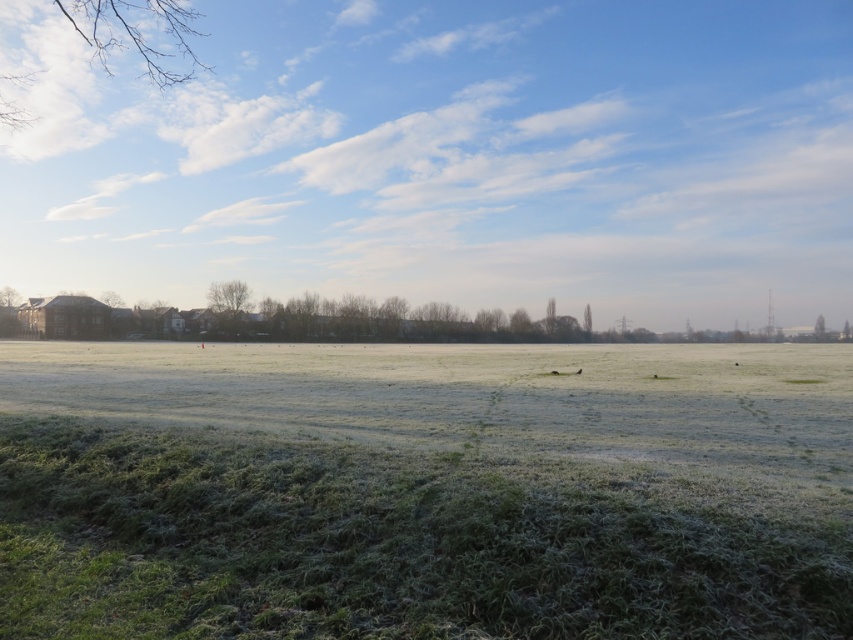
Question: Which point is closer to the camera?

Choices:
 (A) frosted grass at lower center
 (B) green matte tree at left
 (C) bare branches at upper left
 (D) green matte tree at right

Answer: (A)

Question: Which of the following is the closest to the observer?

Choices:
 (A) bare branches at upper left
 (B) green matte tree at left
 (C) green matte tree at right
 (D) frosted grass at lower center

Answer: (D)

Question: Can you confirm if frosted grass at lower center is positioned above green matte tree at left?

Choices:
 (A) yes
 (B) no

Answer: (B)

Question: Is bare branches at upper left positioned before green matte tree at left?

Choices:
 (A) yes
 (B) no

Answer: (A)

Question: Among these points, which one is nearest to the camera?

Choices:
 (A) (119, 518)
 (B) (108, 301)
 (C) (824, 326)
 (D) (10, 115)

Answer: (A)

Question: Is green matte tree at left bigger than green matte tree at right?

Choices:
 (A) yes
 (B) no

Answer: (A)